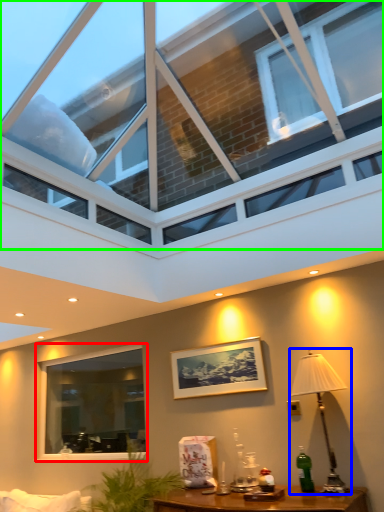
Question: Considering the real-world distances, which object is farthest from window (highlighted by a red box)? table lamp (highlighted by a blue box) or window (highlighted by a green box)?

Choices:
 (A) table lamp
 (B) window

Answer: (B)